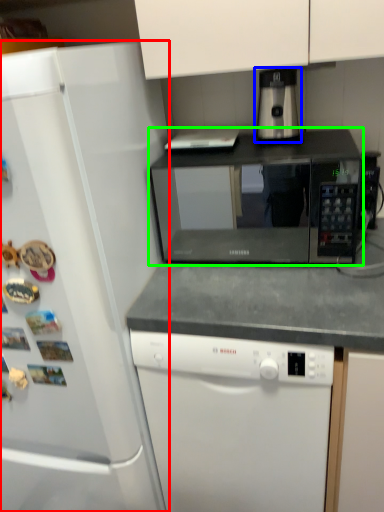
Question: Estimate the real-world distances between objects in this image. Which object is farther from refrigerator (highlighted by a red box), coffee machine (highlighted by a blue box) or microwave oven (highlighted by a green box)?

Choices:
 (A) coffee machine
 (B) microwave oven

Answer: (B)